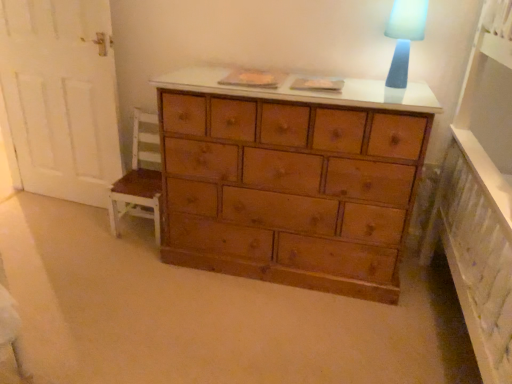
Question: Is blue fabric lampshade at upper right taller or shorter than white painted wood chair at left?

Choices:
 (A) short
 (B) tall

Answer: (A)

Question: Is point (398, 46) positioned closer to the camera than point (153, 188)?

Choices:
 (A) closer
 (B) farther

Answer: (A)

Question: Visually, is blue fabric lampshade at upper right positioned to the left or to the right of white painted wood chair at left?

Choices:
 (A) right
 (B) left

Answer: (A)

Question: In terms of height, does white painted wood chair at left look taller or shorter compared to blue fabric lampshade at upper right?

Choices:
 (A) tall
 (B) short

Answer: (A)

Question: From the image's perspective, relative to blue fabric lampshade at upper right, is white painted wood chair at left above or below?

Choices:
 (A) above
 (B) below

Answer: (B)

Question: From a real-world perspective, relative to blue fabric lampshade at upper right, is white painted wood chair at left vertically above or below?

Choices:
 (A) above
 (B) below

Answer: (B)

Question: Relative to blue fabric lampshade at upper right, is white painted wood chair at left in front or behind?

Choices:
 (A) behind
 (B) front

Answer: (A)